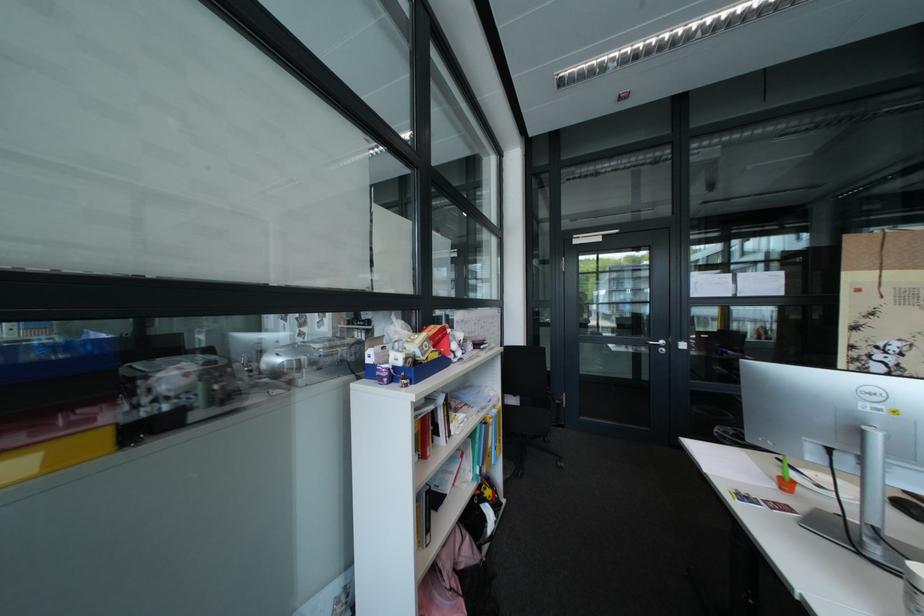
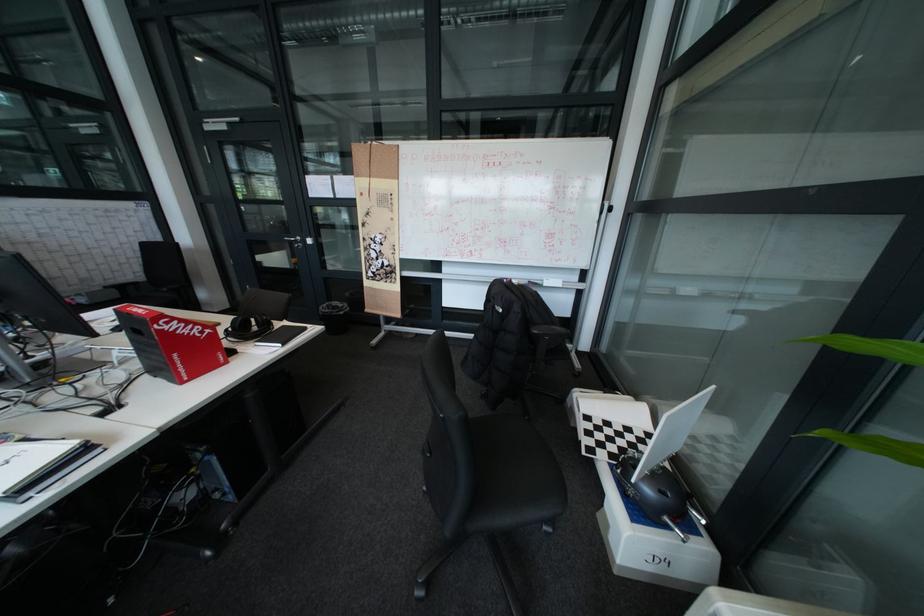
Question: The images are taken continuously from a first-person perspective. In which direction are you moving?

Choices:
 (A) Left
 (B) Right
 (C) Forward
 (D) Backward

Answer: (B)